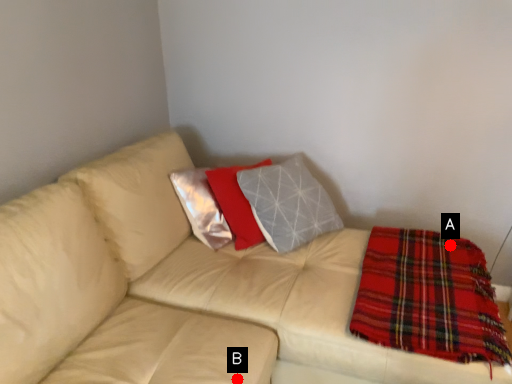
Question: Two points are circled on the image, labeled by A and B beside each circle. Among these points, which one is nearest to the camera?

Choices:
 (A) A is closer
 (B) B is closer

Answer: (B)